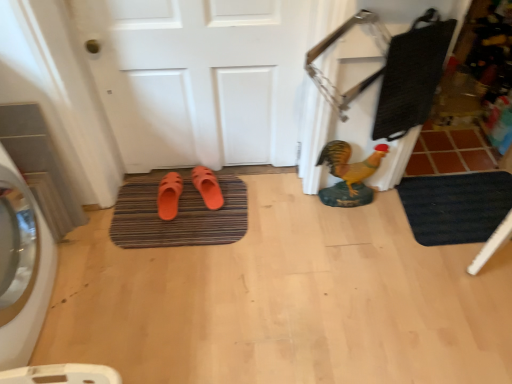
You are a GUI agent. You are given a task and a screenshot of the screen. Output one action in this format:
    pyautogui.click(x=<x>, y=<y>)
    Task: Click on the vacant area that is in front of orange rubber slipper at center, marked as the 2th footwear in a left-to-right arrangement
    
    Given the screenshot: What is the action you would take?
    pyautogui.click(x=203, y=228)